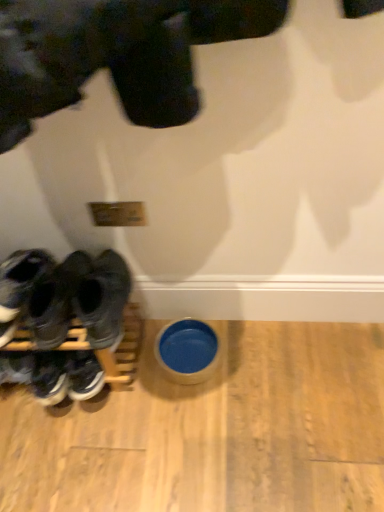
Question: From a real-world perspective, is black rubber shoes at left, the 3th footwear viewed from the left, above or below blue ceramic bowl at lower center?

Choices:
 (A) above
 (B) below

Answer: (A)

Question: Is black rubber shoes at left, the 3th footwear viewed from the left, inside the boundaries of blue ceramic bowl at lower center, or outside?

Choices:
 (A) inside
 (B) outside

Answer: (B)

Question: Which object is the farthest from the dark gray suede sneakers at left, the second footwear from the left?

Choices:
 (A) black leather sneakers at left, which is the third footwear from right to left
 (B) black rubber shoes at left, which is the 1th footwear in right-to-left order
 (C) blue ceramic bowl at lower center

Answer: (C)

Question: Estimate the real-world distances between objects in this image. Which object is closer to the black rubber shoes at left, which is the 1th footwear in right-to-left order?

Choices:
 (A) blue ceramic bowl at lower center
 (B) black leather sneakers at left, which is counted as the 1th footwear, starting from the left
 (C) dark gray suede sneakers at left, the second footwear from the left

Answer: (B)